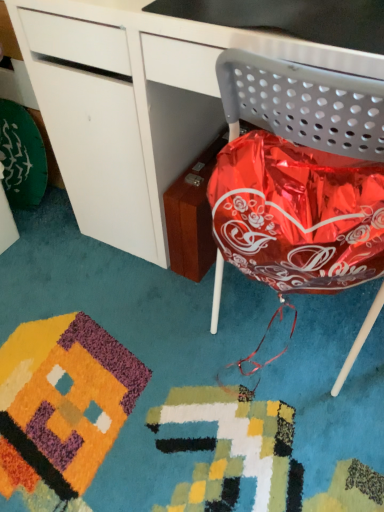
Question: Looking at the image, does metallic gray chair at right seem bigger or smaller compared to glossy white desk at center?

Choices:
 (A) small
 (B) big

Answer: (A)

Question: Considering their positions, is metallic gray chair at right located in front of or behind glossy white desk at center?

Choices:
 (A) front
 (B) behind

Answer: (A)

Question: Considering the positions of metallic gray chair at right and glossy white desk at center in the image, is metallic gray chair at right taller or shorter than glossy white desk at center?

Choices:
 (A) tall
 (B) short

Answer: (B)

Question: From a real-world perspective, is glossy white desk at center above or below metallic gray chair at right?

Choices:
 (A) above
 (B) below

Answer: (B)

Question: Looking at their shapes, would you say glossy white desk at center is wider or thinner than metallic gray chair at right?

Choices:
 (A) thin
 (B) wide

Answer: (B)

Question: Relative to metallic gray chair at right, is glossy white desk at center in front or behind?

Choices:
 (A) front
 (B) behind

Answer: (B)

Question: Based on their positions, is glossy white desk at center located to the left or right of metallic gray chair at right?

Choices:
 (A) left
 (B) right

Answer: (A)